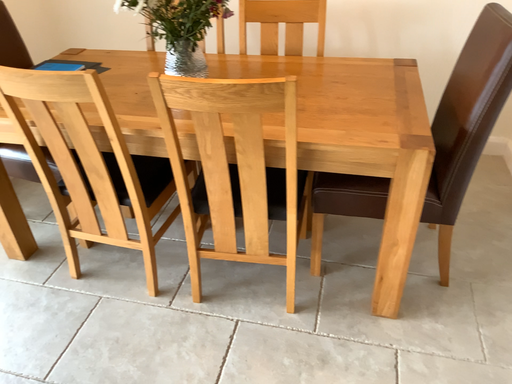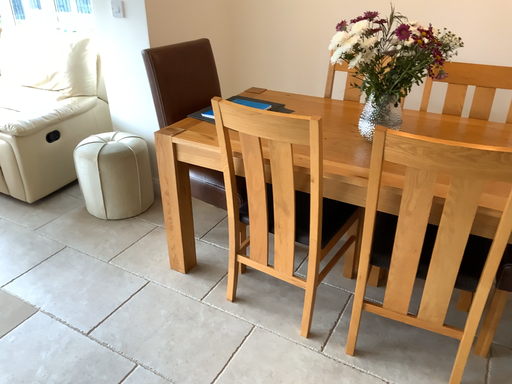
Question: How did the camera likely rotate when shooting the video?

Choices:
 (A) rotated downward
 (B) rotated upward

Answer: (B)